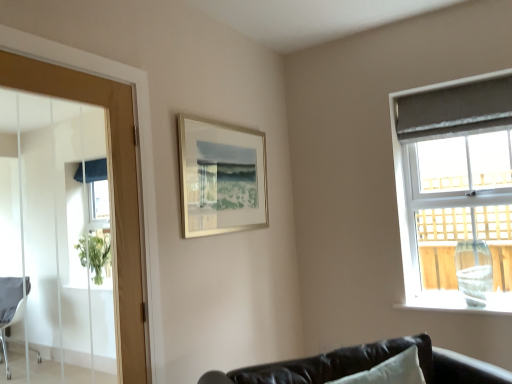
This screenshot has height=384, width=512. What do you see at coordinates (221, 177) in the screenshot? I see `silver metallic picture frame at upper center` at bounding box center [221, 177].

Where is `wooden door at left`? This screenshot has width=512, height=384. wooden door at left is located at coordinates (110, 190).

Where is `silver metallic picture frame at upper center`? silver metallic picture frame at upper center is located at coordinates (221, 177).

Would you say gray fabric curtain at upper right contains silver metallic picture frame at upper center?

No, silver metallic picture frame at upper center is not a part of gray fabric curtain at upper right.

Is gray fabric curtain at upper right oriented away from silver metallic picture frame at upper center?

No.

Is gray fabric curtain at upper right further to the viewer compared to silver metallic picture frame at upper center?

Yes, it is.

Can you confirm if gray fabric curtain at upper right is thinner than silver metallic picture frame at upper center?

Incorrect, the width of gray fabric curtain at upper right is not less than that of silver metallic picture frame at upper center.

Is wooden door at left not within gray fabric curtain at upper right?

wooden door at left is positioned outside gray fabric curtain at upper right.

Considering the relative sizes of wooden door at left and gray fabric curtain at upper right in the image provided, is wooden door at left wider than gray fabric curtain at upper right?

Correct, the width of wooden door at left exceeds that of gray fabric curtain at upper right.

From the picture: What's the angular difference between wooden door at left and gray fabric curtain at upper right's facing directions?

89.9 degrees.

Is silver metallic picture frame at upper center turned away from gray fabric curtain at upper right?

No, silver metallic picture frame at upper center is not facing the opposite direction of gray fabric curtain at upper right.

Between point (265, 202) and point (510, 101), which one is positioned in front?

The point (510, 101) is closer to the camera.

From a real-world perspective, which is physically below, silver metallic picture frame at upper center or gray fabric curtain at upper right?

silver metallic picture frame at upper center is physically lower.

Who is bigger, silver metallic picture frame at upper center or gray fabric curtain at upper right?

Bigger between the two is silver metallic picture frame at upper center.

Is gray fabric curtain at upper right spatially inside matte gray curtain at right, or outside of it?

gray fabric curtain at upper right is spatially positioned inside matte gray curtain at right.

Is gray fabric curtain at upper right wider than matte gray curtain at right?

In fact, gray fabric curtain at upper right might be narrower than matte gray curtain at right.

Where is `window below the gray fabric curtain at upper right (from a real-world perspective)`? This screenshot has width=512, height=384. window below the gray fabric curtain at upper right (from a real-world perspective) is located at coordinates (455, 189).

What are the coordinates of `window in front of the gray fabric curtain at upper right` in the screenshot? It's located at (455, 189).

What's the angular difference between matte gray curtain at right and gray fabric curtain at upper right's facing directions?

There is a 0.000927-degree angle between the facing directions of matte gray curtain at right and gray fabric curtain at upper right.

Which is more to the right, matte gray curtain at right or gray fabric curtain at upper right?

Positioned to the right is matte gray curtain at right.

Can you confirm if matte gray curtain at right is smaller than gray fabric curtain at upper right?

Actually, matte gray curtain at right might be larger than gray fabric curtain at upper right.

Which of these two, matte gray curtain at right or wooden door at left, is thinner?

Thinner between the two is wooden door at left.

From the image's perspective, would you say matte gray curtain at right is shown under wooden door at left?

No, from the image's perspective, matte gray curtain at right is not beneath wooden door at left.

Is point (430, 163) farther from viewer compared to point (124, 87)?

Yes.

Is silver metallic picture frame at upper center located outside wooden door at left?

silver metallic picture frame at upper center lies outside wooden door at left's area.

Does point (187, 150) appear closer or farther from the camera than point (132, 196)?

Point (187, 150) is positioned farther from the camera compared to point (132, 196).

Considering the relative positions of silver metallic picture frame at upper center and wooden door at left in the image provided, is silver metallic picture frame at upper center behind wooden door at left?

That is True.

From the picture: From the image's perspective, is silver metallic picture frame at upper center above wooden door at left?

Indeed, from the image's perspective, silver metallic picture frame at upper center is shown above wooden door at left.

The height and width of the screenshot is (384, 512). In order to click on curtain above the silver metallic picture frame at upper center (from the image's perspective) in this screenshot , I will do `click(455, 108)`.

Locate an element on the screen. The image size is (512, 384). door located on the left of gray fabric curtain at upper right is located at coordinates (110, 190).

Which object lies nearer to the anchor point silver metallic picture frame at upper center, wooden door at left or gray fabric curtain at upper right?

wooden door at left.

Considering their positions, is silver metallic picture frame at upper center positioned closer to matte gray curtain at right than gray fabric curtain at upper right?

The object closer to matte gray curtain at right is gray fabric curtain at upper right.

Which object lies nearer to the anchor point gray fabric curtain at upper right, matte gray curtain at right or silver metallic picture frame at upper center?

matte gray curtain at right is positioned closer to the anchor gray fabric curtain at upper right.

When comparing their distances from matte gray curtain at right, does wooden door at left or gray fabric curtain at upper right seem further?

wooden door at left is positioned further to the anchor matte gray curtain at right.

From the image, which object appears to be farther from wooden door at left, matte gray curtain at right or gray fabric curtain at upper right?

The object further to wooden door at left is gray fabric curtain at upper right.

Estimate the real-world distances between objects in this image. Which object is closer to silver metallic picture frame at upper center, gray fabric curtain at upper right or matte gray curtain at right?

matte gray curtain at right is positioned closer to the anchor silver metallic picture frame at upper center.

Looking at this image, based on their spatial positions, is silver metallic picture frame at upper center or matte gray curtain at right closer to wooden door at left?

The object closer to wooden door at left is silver metallic picture frame at upper center.

Looking at the image, which one is located closer to silver metallic picture frame at upper center, matte gray curtain at right or gray fabric curtain at upper right?

matte gray curtain at right is closer to silver metallic picture frame at upper center.

Identify the location of curtain between wooden door at left and matte gray curtain at right in the horizontal direction. The width and height of the screenshot is (512, 384). (455, 108).

Locate an element on the screen. Image resolution: width=512 pixels, height=384 pixels. picture frame between wooden door at left and matte gray curtain at right is located at coordinates (221, 177).

This screenshot has height=384, width=512. Find the location of `picture frame between wooden door at left and gray fabric curtain at upper right`. picture frame between wooden door at left and gray fabric curtain at upper right is located at coordinates (221, 177).

Where is `curtain between silver metallic picture frame at upper center and matte gray curtain at right in the horizontal direction`? The image size is (512, 384). curtain between silver metallic picture frame at upper center and matte gray curtain at right in the horizontal direction is located at coordinates (455, 108).